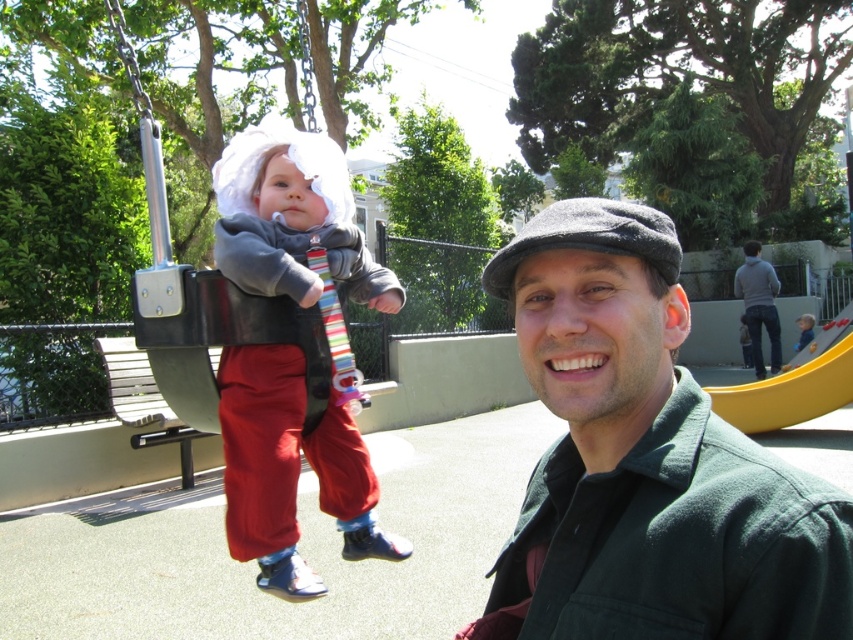
Question: Does green woolen jacket at center have a greater width compared to matte gray sweater at center?

Choices:
 (A) yes
 (B) no

Answer: (B)

Question: Which point is closer to the camera taking this photo?

Choices:
 (A) (329, 152)
 (B) (154, 348)
 (C) (775, 323)
 (D) (596, 314)

Answer: (D)

Question: Which object is farther from the camera taking this photo?

Choices:
 (A) dark gray woolen cap at upper center
 (B) green woolen jacket at center
 (C) matte gray sweater at center
 (D) light blue knit sweater at center

Answer: (D)

Question: Where is matte gray sweater at center located in relation to light blue knit sweater at center in the image?

Choices:
 (A) below
 (B) above

Answer: (B)

Question: Which point is closer to the camera?

Choices:
 (A) matte gray sweater at center
 (B) black plastic swing at upper left
 (C) light blue knit sweater at center

Answer: (A)

Question: Does matte gray sweater at center have a smaller size compared to dark gray woolen cap at upper center?

Choices:
 (A) no
 (B) yes

Answer: (B)